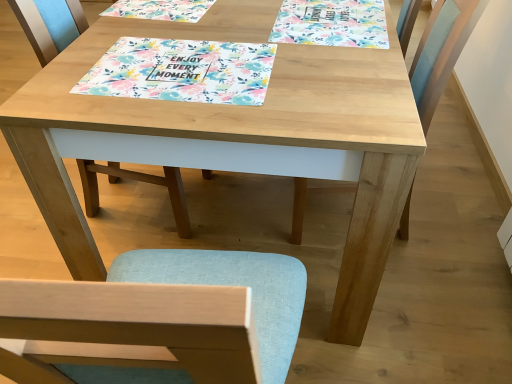
In order to click on free spot in front of floral paper placemat at center in this screenshot , I will do `click(179, 115)`.